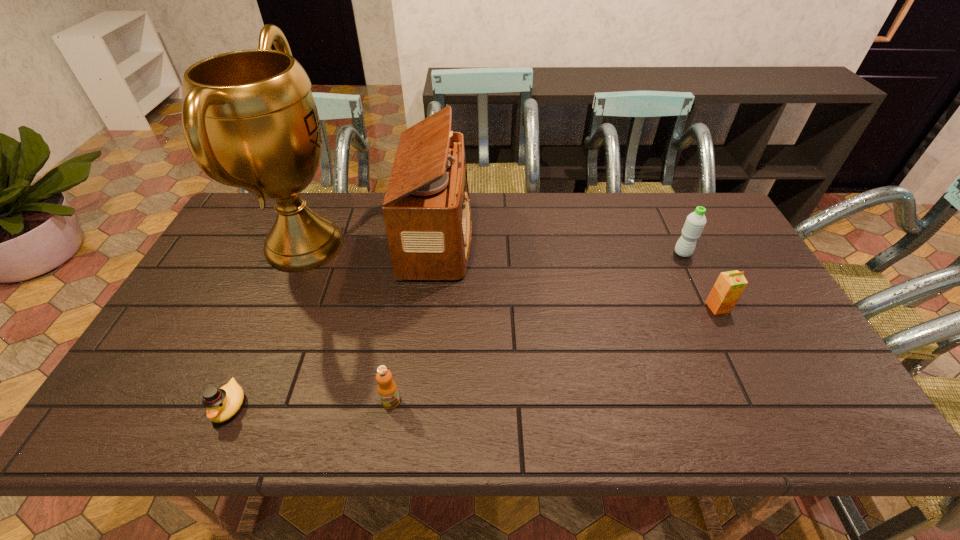
You are a GUI agent. You are given a task and a screenshot of the screen. Output one action in this format:
    pyautogui.click(x=<x>, y=<y>)
    Task: Click on the trophy cup that is at the far edge
    Image resolution: width=960 pixels, height=540 pixels.
    Given the screenshot: What is the action you would take?
    pyautogui.click(x=250, y=120)

In order to click on radio receiver situated at the far edge in this screenshot , I will do `click(426, 209)`.

Locate an element on the screen. Image resolution: width=960 pixels, height=540 pixels. orange juice located in the near edge section of the desktop is located at coordinates (387, 389).

I want to click on duck positioned at the near edge, so click(x=221, y=404).

Identify the location of object located at the left edge. This screenshot has width=960, height=540. (250, 120).

This screenshot has height=540, width=960. What are the coordinates of `object that is at the right edge` in the screenshot? It's located at (729, 286).

Where is `object that is at the far left corner`? Image resolution: width=960 pixels, height=540 pixels. object that is at the far left corner is located at coordinates (250, 120).

Locate an element on the screen. This screenshot has width=960, height=540. free spot at the far edge of the desktop is located at coordinates (376, 222).

You are a GUI agent. You are given a task and a screenshot of the screen. Output one action in this format:
    pyautogui.click(x=<x>, y=<y>)
    Task: Click on the blank space at the near edge of the desktop
    
    Given the screenshot: What is the action you would take?
    point(524,429)

In order to click on free space at the left edge of the desktop in this screenshot , I will do `click(193, 305)`.